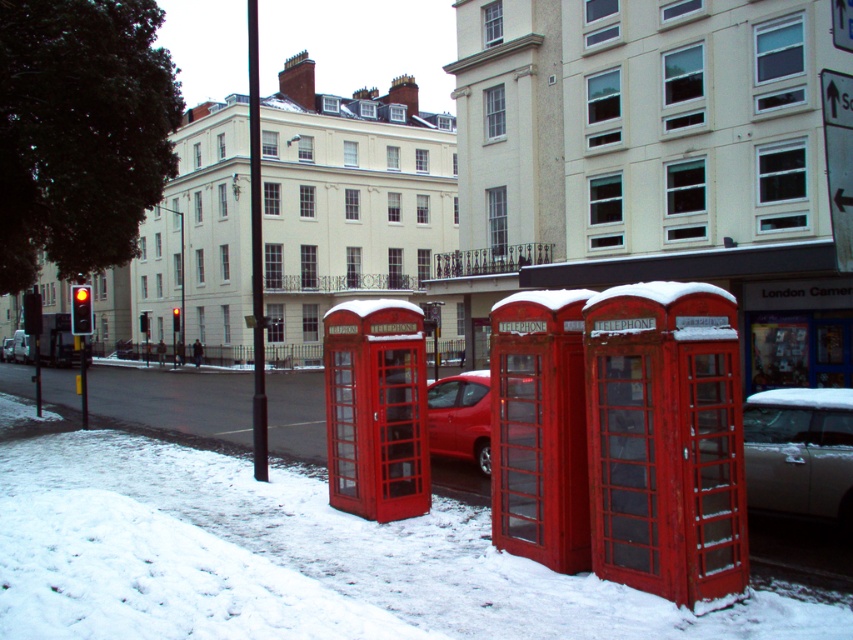
You are a delivery person trying to navigate through the snowy street. You see a snowy red phone booth at center and a matte glass telephone booth at center. Which one is positioned lower in the image?

The snowy red phone booth at center is located below the matte glass telephone booth at center, so it is positioned lower in the image.

You are a delivery person trying to park a tall delivery van that is 2 meters in height. You see the white glossy car at lower right and the shiny red car at center in the parking area. Which car should you avoid parking next to to ensure there is enough vertical clearance for your van?

You should avoid parking next to the white glossy car at lower right because it has a greater height compared to the shiny red car at center, which means there is less vertical clearance available there.

You are a pedestrian standing at the crosswalk and want to reach the white glossy car at lower right. Which direction should you walk to get there from the snowy red phone booth at center?

The snowy red phone booth at center is to the left of the white glossy car at lower right, so you should walk to the right to reach the white glossy car at lower right.